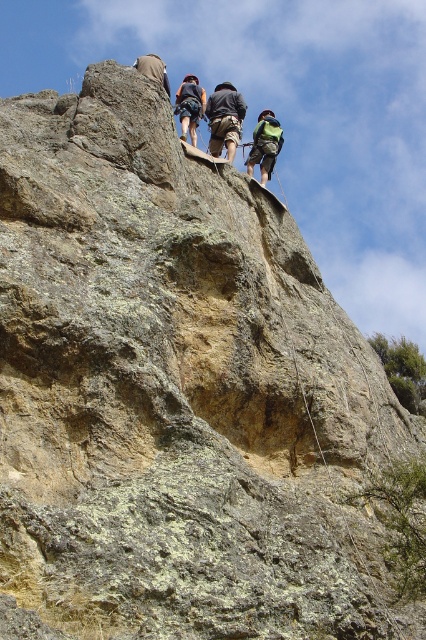
You are a climber looking to secure your gear. You have a green fabric backpack at upper right and dark blue jeans at upper center. Which item is closer to you?

The green fabric backpack at upper right is closer to you because it is further to the viewer than the dark blue jeans at upper center.

You are a photographer trying to capture a wide shot of the climbers on the cliff. You notice two climbers wearing camouflage pants at center and dark blue jeans at upper center. Which climber should you focus on to ensure their clothing detail is more prominent in the photo?

The camouflage pants at center has a lesser width compared to dark blue jeans at upper center, so focusing on the dark blue jeans at upper center will make their clothing detail more prominent in the photo.

You are a hiker planning to climb the cliff and see the green fabric backpack at upper right and the dark blue jeans at upper center. Which item is bigger in size?

The green fabric backpack at upper right is larger in size compared to the dark blue jeans at upper center according to the description.